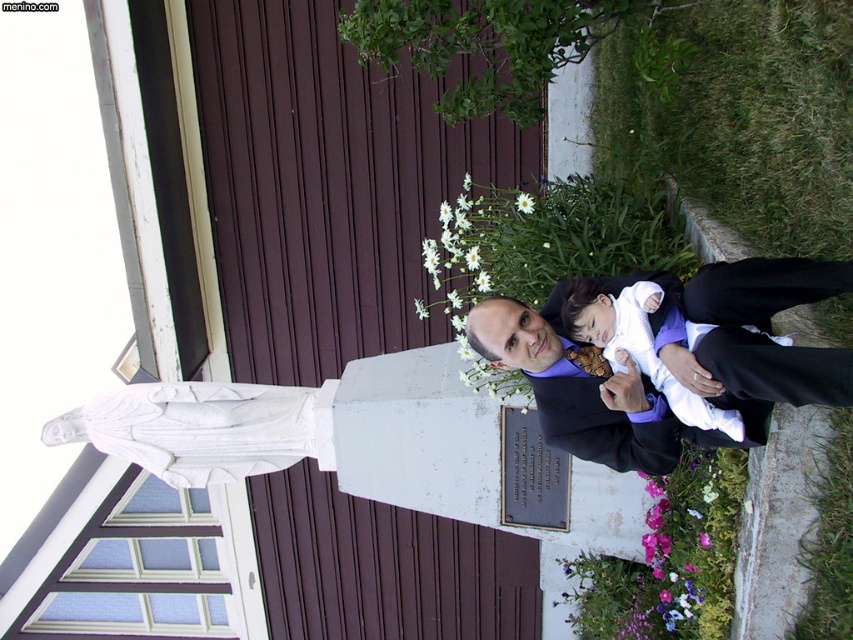
Question: Which object is closer to the camera taking this photo?

Choices:
 (A) black satin suit at right
 (B) white fabric baby at center

Answer: (A)

Question: Which object appears closest to the camera in this image?

Choices:
 (A) black satin suit at right
 (B) white fabric baby at center

Answer: (A)

Question: From the image, what is the correct spatial relationship of black satin suit at right in relation to white fabric baby at center?

Choices:
 (A) above
 (B) below

Answer: (B)

Question: Can you confirm if black satin suit at right is positioned below white fabric baby at center?

Choices:
 (A) no
 (B) yes

Answer: (B)

Question: Is black satin suit at right thinner than white fabric baby at center?

Choices:
 (A) yes
 (B) no

Answer: (B)